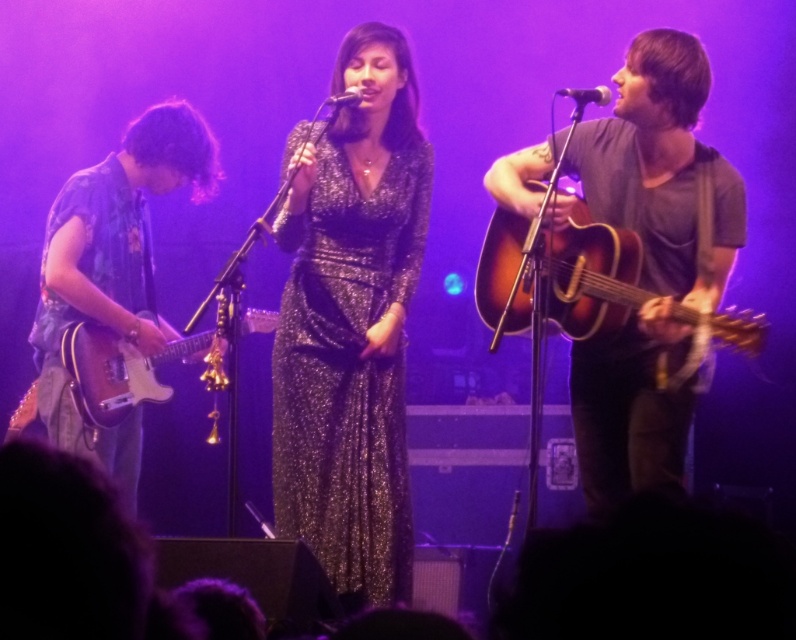
Which is in front, point (638, 228) or point (34, 317)?

Point (638, 228) is in front.

Is the position of matte brown acoustic guitar at right more distant than that of blue floral shirt at left?

No.

Does point (654, 288) lie behind point (41, 284)?

No, (654, 288) is in front of (41, 284).

Image resolution: width=796 pixels, height=640 pixels. I want to click on matte brown acoustic guitar at right, so click(x=650, y=266).

Between sparkly metallic dress at center and sunburst wood acoustic guitar at right, which one is positioned higher?

sunburst wood acoustic guitar at right is higher up.

Can you confirm if sparkly metallic dress at center is positioned to the right of sunburst wood acoustic guitar at right?

Incorrect, sparkly metallic dress at center is not on the right side of sunburst wood acoustic guitar at right.

Which is in front, point (404, 148) or point (541, 232)?

Point (541, 232) is more forward.

Where is `sparkly metallic dress at center`? The image size is (796, 640). sparkly metallic dress at center is located at coordinates (348, 371).

Looking at this image, is sunburst wood acoustic guitar at right further to camera compared to metallic silver microphone at upper right?

No, it is not.

Can you confirm if sunburst wood acoustic guitar at right is taller than metallic silver microphone at upper right?

Correct, sunburst wood acoustic guitar at right is much taller as metallic silver microphone at upper right.

Identify the location of sunburst wood acoustic guitar at right. The height and width of the screenshot is (640, 796). (591, 276).